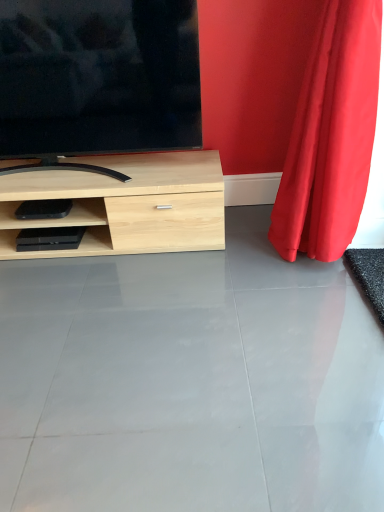
Question: Is point (322, 129) positioned closer to the camera than point (49, 67)?

Choices:
 (A) farther
 (B) closer

Answer: (B)

Question: In terms of width, does red velvet curtain at right look wider or thinner when compared to matte black tv at upper left?

Choices:
 (A) thin
 (B) wide

Answer: (B)

Question: Which is nearer to the gray glossy concrete at center?

Choices:
 (A) matte black tv at upper left
 (B) red velvet curtain at right

Answer: (B)

Question: Which object is the farthest from the matte black tv at upper left?

Choices:
 (A) red velvet curtain at right
 (B) gray glossy concrete at center

Answer: (B)